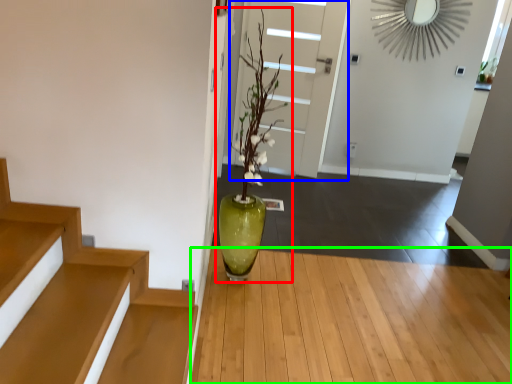
Question: Which object is the closest to the houseplant (highlighted by a red box)? Choose among these: door (highlighted by a blue box) or hardwood (highlighted by a green box).

Choices:
 (A) door
 (B) hardwood

Answer: (B)